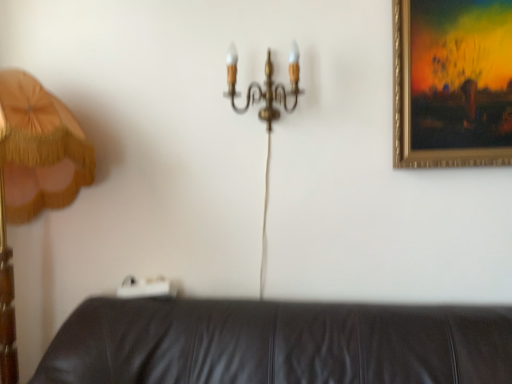
The width and height of the screenshot is (512, 384). What do you see at coordinates (452, 83) in the screenshot? I see `gold-framed painting at upper right` at bounding box center [452, 83].

Image resolution: width=512 pixels, height=384 pixels. Identify the location of wooden lampshade at left. (33, 178).

The height and width of the screenshot is (384, 512). I want to click on gold metallic chandelier at upper center, so click(x=265, y=86).

You are a GUI agent. You are given a task and a screenshot of the screen. Output one action in this format:
    pyautogui.click(x=<x>, y=<y>)
    Task: Click on the gold-framed painting at upper right
    
    Given the screenshot: What is the action you would take?
    pyautogui.click(x=452, y=83)

How different are the orientations of gold-framed painting at upper right and wooden lampshade at left in degrees?

There is a 0.699-degree angle between the facing directions of gold-framed painting at upper right and wooden lampshade at left.

Can you confirm if gold-framed painting at upper right is thinner than wooden lampshade at left?

Yes, gold-framed painting at upper right is thinner than wooden lampshade at left.

Find the location of a particular element. The height and width of the screenshot is (384, 512). lamp on the left of the gold-framed painting at upper right is located at coordinates (33, 178).

Is gold-framed painting at upper right aimed at wooden lampshade at left?

No, gold-framed painting at upper right is not aimed at wooden lampshade at left.

Is wooden lampshade at left turned away from gold metallic chandelier at upper center?

No, gold metallic chandelier at upper center is not at the back of wooden lampshade at left.

In terms of height, does wooden lampshade at left look taller or shorter compared to gold metallic chandelier at upper center?

Clearly, wooden lampshade at left is taller compared to gold metallic chandelier at upper center.

Find the location of a particular element. Image resolution: width=512 pixels, height=384 pixels. lamp in front of the gold metallic chandelier at upper center is located at coordinates (33, 178).

Can wooden lampshade at left be found inside gold metallic chandelier at upper center?

No.

Is gold metallic chandelier at upper center positioned beyond the bounds of gold-framed painting at upper right?

Indeed, gold metallic chandelier at upper center is completely outside gold-framed painting at upper right.

What's the angular difference between gold metallic chandelier at upper center and gold-framed painting at upper right's facing directions?

0.162 degrees.

Find the location of a particular element. This screenshot has height=384, width=512. picture frame directly beneath the gold metallic chandelier at upper center (from a real-world perspective) is located at coordinates (452, 83).

From the image's perspective, relative to gold-framed painting at upper right, is gold metallic chandelier at upper center above or below?

gold metallic chandelier at upper center is above gold-framed painting at upper right.

Find the location of `lamp below the gold-framed painting at upper right (from a real-world perspective)`. lamp below the gold-framed painting at upper right (from a real-world perspective) is located at coordinates (33, 178).

Considering the relative sizes of wooden lampshade at left and gold-framed painting at upper right in the image provided, is wooden lampshade at left thinner than gold-framed painting at upper right?

Incorrect, the width of wooden lampshade at left is not less than that of gold-framed painting at upper right.

Does wooden lampshade at left have a lesser height compared to gold-framed painting at upper right?

Incorrect, the height of wooden lampshade at left does not fall short of that of gold-framed painting at upper right.

From the image's perspective, which one is positioned lower, wooden lampshade at left or gold-framed painting at upper right?

wooden lampshade at left.

From the image's perspective, is gold-framed painting at upper right over gold metallic chandelier at upper center?

No.

Which is nearer, (490, 148) or (281, 97)?

Clearly, point (490, 148) is closer to the camera than point (281, 97).

Is gold-framed painting at upper right directly adjacent to gold metallic chandelier at upper center?

No, gold-framed painting at upper right is not in contact with gold metallic chandelier at upper center.

Where is `lamp directly beneath the gold-framed painting at upper right (from a real-world perspective)`? lamp directly beneath the gold-framed painting at upper right (from a real-world perspective) is located at coordinates (x=33, y=178).

Image resolution: width=512 pixels, height=384 pixels. In the image, there is a wooden lampshade at left. Find the location of `chandelier above it (from the image's perspective)`. chandelier above it (from the image's perspective) is located at coordinates (265, 86).

Considering their positions, is wooden lampshade at left positioned closer to gold-framed painting at upper right than gold metallic chandelier at upper center?

gold metallic chandelier at upper center is positioned closer to the anchor gold-framed painting at upper right.

From the image, which object appears to be farther from wooden lampshade at left, gold-framed painting at upper right or gold metallic chandelier at upper center?

gold-framed painting at upper right is positioned further to the anchor wooden lampshade at left.

When comparing their distances from wooden lampshade at left, does gold metallic chandelier at upper center or gold-framed painting at upper right seem closer?

Based on the image, gold metallic chandelier at upper center appears to be nearer to wooden lampshade at left.

From the image, which object appears to be nearer to gold metallic chandelier at upper center, gold-framed painting at upper right or wooden lampshade at left?

Among the two, gold-framed painting at upper right is located nearer to gold metallic chandelier at upper center.

Estimate the real-world distances between objects in this image. Which object is closer to gold metallic chandelier at upper center, wooden lampshade at left or gold-framed painting at upper right?

Based on the image, gold-framed painting at upper right appears to be nearer to gold metallic chandelier at upper center.

When comparing their distances from gold-framed painting at upper right, does gold metallic chandelier at upper center or wooden lampshade at left seem further?

→ Based on the image, wooden lampshade at left appears to be further to gold-framed painting at upper right.

In order to click on chandelier located between wooden lampshade at left and gold-framed painting at upper right in the left-right direction in this screenshot , I will do `click(265, 86)`.